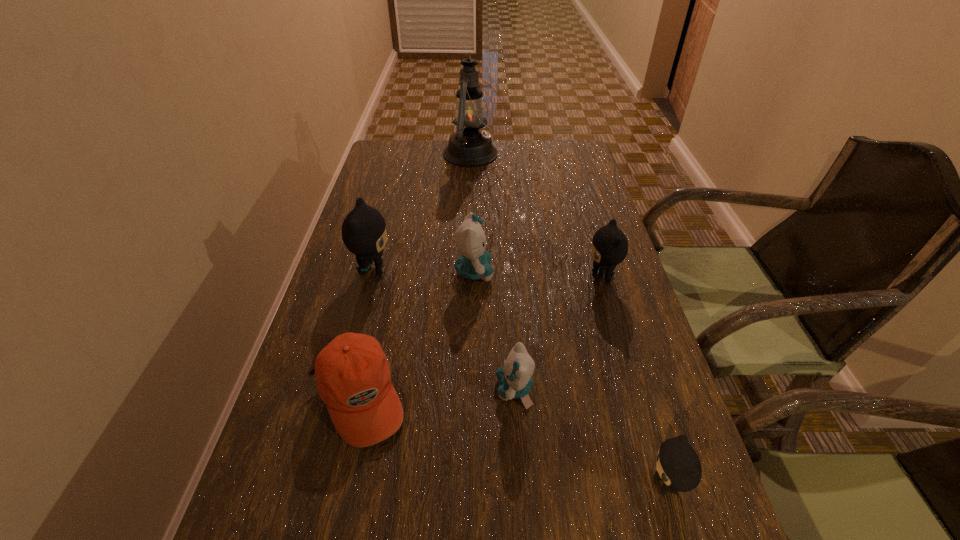
I want to click on the smallest gray kitten, so click(678, 466).

In order to click on vacant area situated on the left of the farthest object in this screenshot , I will do `click(375, 154)`.

Locate an element on the screen. The image size is (960, 540). vacant space situated on the front-facing side of the biggest gray kitten is located at coordinates (433, 270).

I want to click on free location located on the face of the bigger blue kitten, so click(x=592, y=272).

I want to click on free space located 0.160m on the front-facing side of the second smallest gray kitten, so click(521, 276).

This screenshot has height=540, width=960. Identify the location of vacant region located on the front-facing side of the second smallest gray kitten. (516, 276).

Where is `vacant space located on the front-facing side of the second smallest gray kitten`? The height and width of the screenshot is (540, 960). vacant space located on the front-facing side of the second smallest gray kitten is located at coordinates (533, 276).

At what (x,y) coordinates should I click in order to perform the action: click on vacant space located 0.260m on the face of the nearer blue kitten. Please return your answer as a coordinate pair (x, y). Looking at the image, I should click on (362, 389).

This screenshot has height=540, width=960. Identify the location of vacant space located on the face of the nearer blue kitten. (414, 389).

Locate an element on the screen. This screenshot has height=540, width=960. vacant area located on the face of the nearer blue kitten is located at coordinates (454, 389).